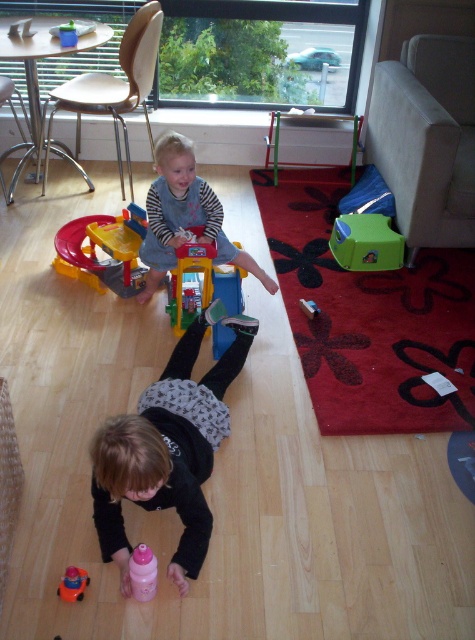
Between rubber pink sippy cup at lower center and rubberized plastic toy car at center, which one is positioned higher?

rubberized plastic toy car at center is higher up.

This screenshot has width=475, height=640. What are the coordinates of `rubber pink sippy cup at lower center` in the screenshot? It's located at (73, 582).

Is point (85, 586) farther from camera compared to point (304, 310)?

No, (85, 586) is in front of (304, 310).

Image resolution: width=475 pixels, height=640 pixels. What are the coordinates of `rubber pink sippy cup at lower center` in the screenshot? It's located at (73, 582).

This screenshot has height=640, width=475. What do you see at coordinates (366, 243) in the screenshot?
I see `green plastic toy at lower right` at bounding box center [366, 243].

Who is lower down, green plastic toy at lower right or rubberized plastic toy car at center?

rubberized plastic toy car at center is lower down.

The height and width of the screenshot is (640, 475). Identify the location of green plastic toy at lower right. (366, 243).

Does green plastic toy at lower right lie in front of pink plastic bottle at lower center?

No, it is behind pink plastic bottle at lower center.

Measure the distance between green plastic toy at lower right and camera.

They are 2.94 meters apart.

Locate an element on the screen. The image size is (475, 640). green plastic toy at lower right is located at coordinates (366, 243).